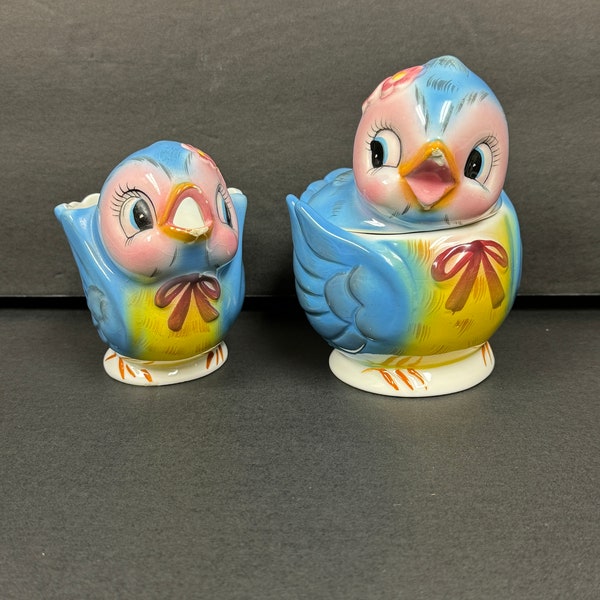
Where is `ceramic birds`? ceramic birds is located at coordinates (176, 268), (408, 256).